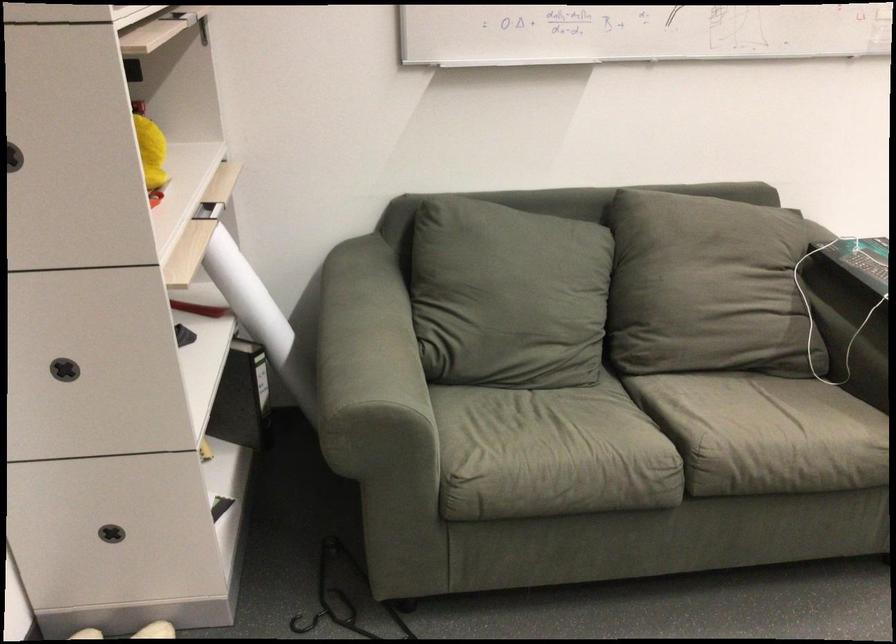
Describe the element at coordinates (653, 444) in the screenshot. This screenshot has width=896, height=644. I see `the sofa sitting surface` at that location.